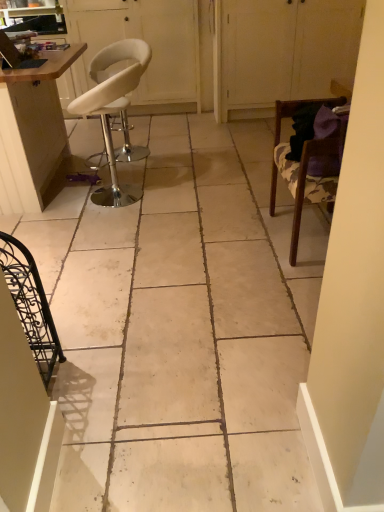
This screenshot has width=384, height=512. What do you see at coordinates (113, 108) in the screenshot?
I see `white leather stool at left, which appears as the 2th chair when viewed from the left` at bounding box center [113, 108].

What do you see at coordinates (31, 305) in the screenshot? The image size is (384, 512). I see `black wrought iron chair at lower left, which appears as the 1th chair when viewed from the front` at bounding box center [31, 305].

Describe the element at coordinates (147, 42) in the screenshot. I see `white leather stool at upper left, the second screen door viewed from the right` at that location.

The width and height of the screenshot is (384, 512). I want to click on wooden table at left, so click(x=32, y=131).

The height and width of the screenshot is (512, 384). Find the location of `the 1st screen door counting from the right side of the wooden table at left`. the 1st screen door counting from the right side of the wooden table at left is located at coordinates (147, 42).

Is wooden table at left positioned beyond the bounds of white leather stool at upper left, the second screen door viewed from the right?

Yes.

Could you tell me if wooden table at left is facing white leather stool at upper left, the second screen door viewed from the right?

No, wooden table at left is not facing towards white leather stool at upper left, the second screen door viewed from the right.

Which point is more forward, [24,73] or [169,34]?

The point [24,73] is in front.

From a real-world perspective, which is physically above, wooden chair at right, which is the second chair from front to back, or white matte cabinet at upper right, arranged as the 1th screen door when viewed from the right?

In real-world perspective, white matte cabinet at upper right, arranged as the 1th screen door when viewed from the right, is above.

Considering the relative sizes of wooden chair at right, the first chair positioned from the right, and white matte cabinet at upper right, which is the 2th screen door in left-to-right order, in the image provided, is wooden chair at right, the first chair positioned from the right, shorter than white matte cabinet at upper right, which is the 2th screen door in left-to-right order,?

Yes.

Considering the positions of objects wooden chair at right, which is the second chair from front to back, and white matte cabinet at upper right, arranged as the 1th screen door when viewed from the right, in the image provided, who is behind, wooden chair at right, which is the second chair from front to back, or white matte cabinet at upper right, arranged as the 1th screen door when viewed from the right,?

white matte cabinet at upper right, arranged as the 1th screen door when viewed from the right, is further away from the camera.

Is wooden chair at right, which is the second chair from front to back, thinner than white matte cabinet at upper right, arranged as the 1th screen door when viewed from the right?

Correct, the width of wooden chair at right, which is the second chair from front to back, is less than that of white matte cabinet at upper right, arranged as the 1th screen door when viewed from the right.

Which is in front, point (146, 102) or point (93, 94)?

The point (93, 94) is closer to the camera.

From a real-world perspective, between white leather stool at upper left, which ranks as the first screen door in left-to-right order, and white leather stool at left, which appears as the 2th chair when viewed from the left, who is vertically higher?

In real-world perspective, white leather stool at upper left, which ranks as the first screen door in left-to-right order, is above.

From the image's perspective, which object appears higher, white leather stool at upper left, the second screen door viewed from the right, or white leather stool at left, the 2th chair from the right?

white leather stool at upper left, the second screen door viewed from the right, from the image's perspective.

From the picture: Considering the sizes of objects wooden table at left and white leather stool at left, which appears as the 2th chair when viewed from the left, in the image provided, who is taller, wooden table at left or white leather stool at left, which appears as the 2th chair when viewed from the left,?

wooden table at left is taller.

Is white leather stool at left, the 1th chair in the back-to-front sequence, a part of wooden table at left?

Definitely not — white leather stool at left, the 1th chair in the back-to-front sequence, is not inside wooden table at left.

The height and width of the screenshot is (512, 384). What are the coordinates of `table behind the white leather stool at left, the 2th chair from the right` in the screenshot? It's located at (32, 131).

Between wooden table at left and white leather stool at left, the 1th chair in the back-to-front sequence, which one is positioned in front?

white leather stool at left, the 1th chair in the back-to-front sequence.

Considering the sizes of objects black wrought iron chair at lower left, the third chair positioned from the back, and white matte cabinet at upper right, arranged as the 1th screen door when viewed from the right, in the image provided, who is smaller, black wrought iron chair at lower left, the third chair positioned from the back, or white matte cabinet at upper right, arranged as the 1th screen door when viewed from the right,?

With smaller size is black wrought iron chair at lower left, the third chair positioned from the back.

Which object is closer to the camera, black wrought iron chair at lower left, the 1th chair from the left, or white matte cabinet at upper right, which is the 2th screen door in left-to-right order?

black wrought iron chair at lower left, the 1th chair from the left.

Is black wrought iron chair at lower left, the 1th chair from the left, oriented towards white matte cabinet at upper right, which is the 2th screen door in left-to-right order?

No, black wrought iron chair at lower left, the 1th chair from the left, is not aimed at white matte cabinet at upper right, which is the 2th screen door in left-to-right order.

Is white matte cabinet at upper right, arranged as the 1th screen door when viewed from the right, positioned with its back to wooden table at left?

No, white matte cabinet at upper right, arranged as the 1th screen door when viewed from the right,'s orientation is not away from wooden table at left.

Locate an element on the screen. the 2nd screen door counting from the right side of the wooden table at left is located at coordinates (283, 51).

From the image's perspective, between white matte cabinet at upper right, which is the 2th screen door in left-to-right order, and wooden table at left, who is located below?

From the image's view, wooden table at left is below.

Which object is positioned more to the left, white matte cabinet at upper right, which is the 2th screen door in left-to-right order, or wooden table at left?

wooden table at left is more to the left.

How different are the orientations of white leather stool at left, which appears as the 2th chair when viewed from the left, and white leather stool at upper left, the second screen door viewed from the right, in degrees?

There is a 95.8-degree angle between the facing directions of white leather stool at left, which appears as the 2th chair when viewed from the left, and white leather stool at upper left, the second screen door viewed from the right.

From the image's perspective, is white leather stool at left, the 1th chair in the back-to-front sequence, positioned above or below white leather stool at upper left, which ranks as the first screen door in left-to-right order?

Clearly, from the image's perspective, white leather stool at left, the 1th chair in the back-to-front sequence, is below white leather stool at upper left, which ranks as the first screen door in left-to-right order.

From a real-world perspective, is white leather stool at left, the 1th chair in the back-to-front sequence, located beneath white leather stool at upper left, the second screen door viewed from the right?

Yes, from a real-world perspective, white leather stool at left, the 1th chair in the back-to-front sequence, is under white leather stool at upper left, the second screen door viewed from the right.

Which object is closer to the camera taking this photo, white leather stool at left, which ranks as the third chair in front-to-back order, or white leather stool at upper left, which ranks as the first screen door in left-to-right order?

Positioned in front is white leather stool at left, which ranks as the third chair in front-to-back order.

At what (x,y) coordinates should I click in order to perform the action: click on table on the left of white leather stool at upper left, which ranks as the first screen door in left-to-right order. Please return your answer as a coordinate pair (x, y). Looking at the image, I should click on (32, 131).

The image size is (384, 512). Identify the location of the 1st screen door above when counting from the wooden chair at right, placed as the second chair when sorted from back to front (from the image's perspective). (283, 51).

Based on their spatial positions, is white leather stool at left, which appears as the 2th chair when viewed from the left, or wooden chair at right, the first chair positioned from the right, closer to white matte cabinet at upper right, arranged as the 1th screen door when viewed from the right?

Among the two, white leather stool at left, which appears as the 2th chair when viewed from the left, is located nearer to white matte cabinet at upper right, arranged as the 1th screen door when viewed from the right.

Looking at the image, which one is located further to white leather stool at left, which ranks as the third chair in front-to-back order, wooden table at left or white leather stool at upper left, which ranks as the first screen door in left-to-right order?

white leather stool at upper left, which ranks as the first screen door in left-to-right order, lies further to white leather stool at left, which ranks as the third chair in front-to-back order, than the other object.

Looking at the image, which one is located closer to black wrought iron chair at lower left, the third chair positioned from the back, white leather stool at upper left, the second screen door viewed from the right, or white matte cabinet at upper right, which is the 2th screen door in left-to-right order?

white leather stool at upper left, the second screen door viewed from the right, lies closer to black wrought iron chair at lower left, the third chair positioned from the back, than the other object.

Estimate the real-world distances between objects in this image. Which object is further from white leather stool at left, the 1th chair in the back-to-front sequence, wooden chair at right, placed as the second chair when sorted from back to front, or black wrought iron chair at lower left, the 1th chair from the left?

black wrought iron chair at lower left, the 1th chair from the left, lies further to white leather stool at left, the 1th chair in the back-to-front sequence, than the other object.

Which object lies further to the anchor point wooden table at left, white leather stool at left, which ranks as the third chair in front-to-back order, or black wrought iron chair at lower left, the third chair positioned from the back?

black wrought iron chair at lower left, the third chair positioned from the back, lies further to wooden table at left than the other object.

Which object lies nearer to the anchor point white leather stool at upper left, the second screen door viewed from the right, wooden chair at right, the third chair positioned from the left, or wooden table at left?

Among the two, wooden table at left is located nearer to white leather stool at upper left, the second screen door viewed from the right.

When comparing their distances from black wrought iron chair at lower left, the 1th chair from the left, does wooden chair at right, placed as the second chair when sorted from back to front, or white leather stool at left, the 1th chair in the back-to-front sequence, seem further?

Among the two, wooden chair at right, placed as the second chair when sorted from back to front, is located further to black wrought iron chair at lower left, the 1th chair from the left.

Considering their positions, is black wrought iron chair at lower left, the 1th chair from the left, positioned further to wooden chair at right, which is the second chair from front to back, than wooden table at left?

The object further to wooden chair at right, which is the second chair from front to back, is wooden table at left.

Where is `screen door located between white leather stool at left, the 1th chair in the back-to-front sequence, and white leather stool at upper left, the second screen door viewed from the right, in the depth direction`? This screenshot has height=512, width=384. screen door located between white leather stool at left, the 1th chair in the back-to-front sequence, and white leather stool at upper left, the second screen door viewed from the right, in the depth direction is located at coordinates (283, 51).

At what (x,y) coordinates should I click in order to perform the action: click on table between black wrought iron chair at lower left, which appears as the 1th chair when viewed from the front, and white matte cabinet at upper right, arranged as the 1th screen door when viewed from the right, from front to back. Please return your answer as a coordinate pair (x, y). Looking at the image, I should click on (32, 131).

This screenshot has height=512, width=384. What are the coordinates of `table between wooden chair at right, the first chair positioned from the right, and white leather stool at upper left, which ranks as the first screen door in left-to-right order, in the front-back direction` in the screenshot? It's located at 32,131.

This screenshot has height=512, width=384. In order to click on table located between black wrought iron chair at lower left, the 3th chair from the right, and white leather stool at upper left, which ranks as the first screen door in left-to-right order, in the depth direction in this screenshot , I will do tap(32, 131).